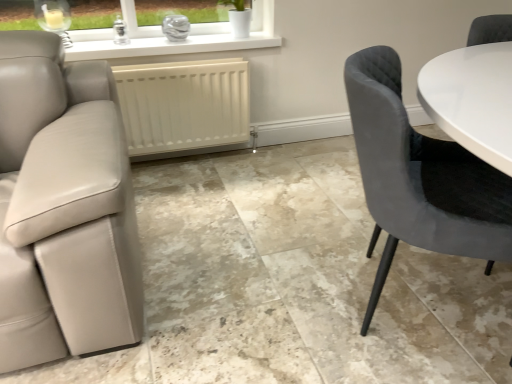
Question: Considering their positions, is velvet grey chair at right located in front of or behind white matte radiator at center?

Choices:
 (A) behind
 (B) front

Answer: (B)

Question: Is velvet grey chair at right situated inside white matte radiator at center or outside?

Choices:
 (A) outside
 (B) inside

Answer: (A)

Question: Considering the positions of velvet grey chair at right and white matte radiator at center in the image, is velvet grey chair at right taller or shorter than white matte radiator at center?

Choices:
 (A) tall
 (B) short

Answer: (A)

Question: In terms of height, does white matte radiator at center look taller or shorter compared to velvet grey chair at right?

Choices:
 (A) short
 (B) tall

Answer: (A)

Question: From a real-world perspective, relative to velvet grey chair at right, is white matte radiator at center vertically above or below?

Choices:
 (A) above
 (B) below

Answer: (B)

Question: Do you think white matte radiator at center is within velvet grey chair at right, or outside of it?

Choices:
 (A) outside
 (B) inside

Answer: (A)

Question: Is white matte radiator at center in front of or behind velvet grey chair at right in the image?

Choices:
 (A) behind
 (B) front

Answer: (A)